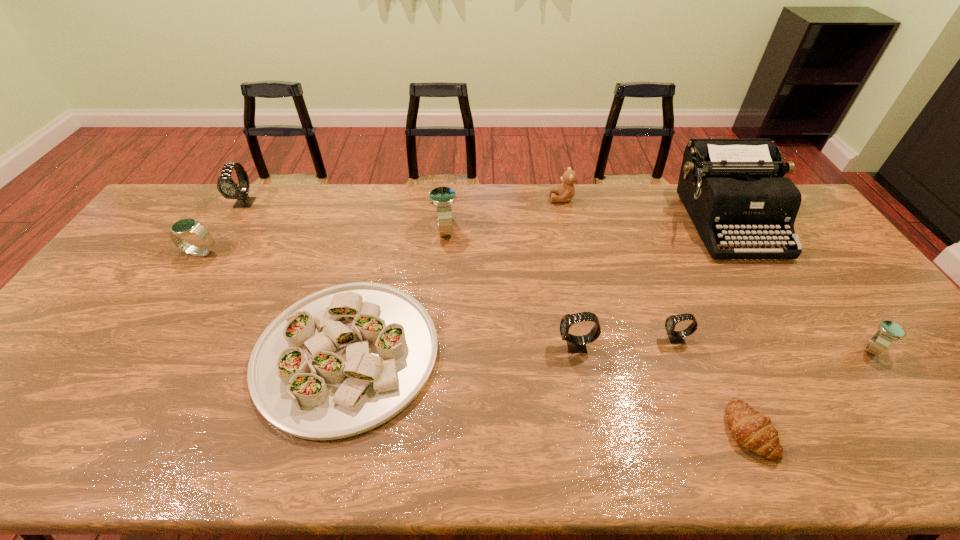
Where is `vacant space at the far edge of the desktop`? The image size is (960, 540). vacant space at the far edge of the desktop is located at coordinates (320, 185).

Where is `vacant region at the near edge`? Image resolution: width=960 pixels, height=540 pixels. vacant region at the near edge is located at coordinates (589, 426).

Locate an element on the screen. vacant space at the left edge of the desktop is located at coordinates (157, 246).

Locate an element on the screen. Image resolution: width=960 pixels, height=540 pixels. vacant region at the right edge of the desktop is located at coordinates (868, 317).

The height and width of the screenshot is (540, 960). What are the coordinates of `free space that is in between the second smallest blue watch and the crescent roll` in the screenshot? It's located at (474, 341).

You are a GUI agent. You are given a task and a screenshot of the screen. Output one action in this format:
    pyautogui.click(x=<x>, y=<y>)
    Task: Click on the empty space between the third farthest watch and the smallest gray watch
    The image size is (960, 540).
    Given the screenshot: What is the action you would take?
    pyautogui.click(x=438, y=296)

At what (x,y) coordinates should I click in order to perform the action: click on free spot between the typewriter and the platter. Please return your answer as a coordinate pair (x, y). The height and width of the screenshot is (540, 960). Looking at the image, I should click on (536, 287).

Where is `empty space between the farthest gray watch and the teddy bear`? empty space between the farthest gray watch and the teddy bear is located at coordinates (403, 201).

Find the location of `unoccupied area between the seventh object from left to right and the brown crescent roll`. unoccupied area between the seventh object from left to right and the brown crescent roll is located at coordinates (711, 384).

Where is `vacant space in between the typewriter and the farthest watch`? The height and width of the screenshot is (540, 960). vacant space in between the typewriter and the farthest watch is located at coordinates (485, 212).